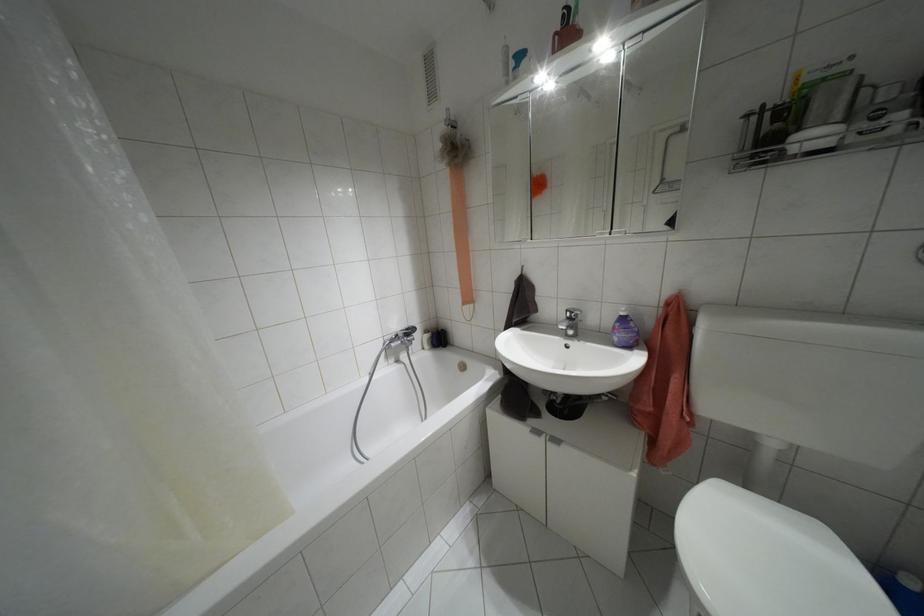
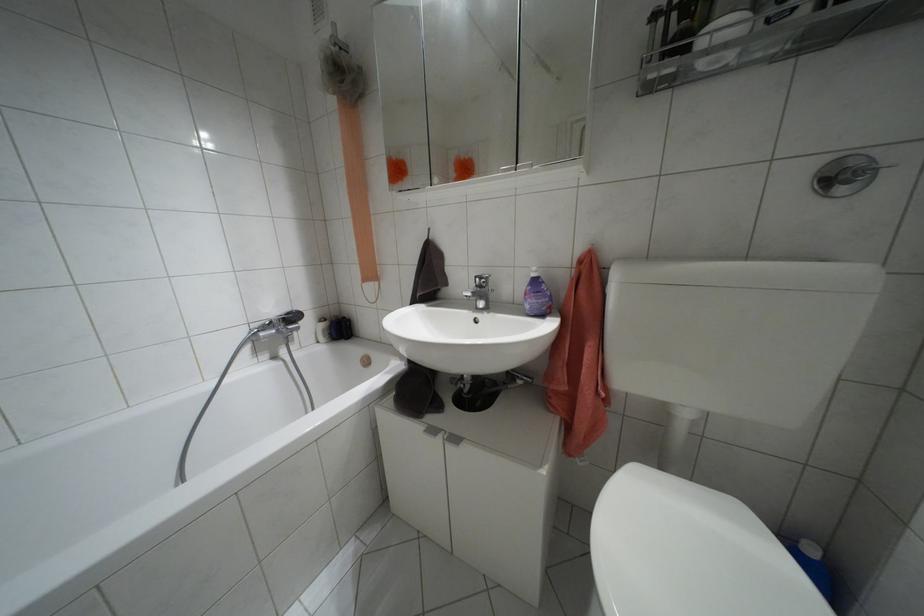
In a continuous first-person perspective shot, in which direction is the camera moving?

The cameraman moved toward right, forward.